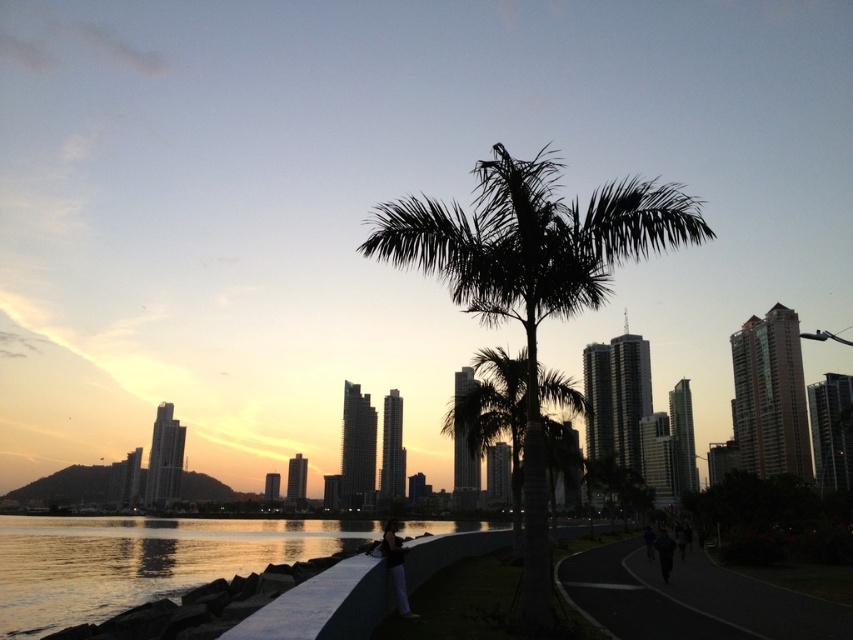
In the scene shown: Is smooth concrete wall at lower center positioned before black fabric pants at lower center?

No, smooth concrete wall at lower center is behind black fabric pants at lower center.

Image resolution: width=853 pixels, height=640 pixels. What are the coordinates of `smooth concrete wall at lower center` in the screenshot? It's located at (140, 561).

Identify the location of smooth concrete wall at lower center. Image resolution: width=853 pixels, height=640 pixels. (140, 561).

Who is higher up, black asphalt road at lower right or green leafy palm tree at center?

green leafy palm tree at center is above.

Can you confirm if black asphalt road at lower right is positioned to the left of green leafy palm tree at center?

In fact, black asphalt road at lower right is to the right of green leafy palm tree at center.

What do you see at coordinates (691, 600) in the screenshot? I see `black asphalt road at lower right` at bounding box center [691, 600].

Locate an element on the screen. The height and width of the screenshot is (640, 853). black asphalt road at lower right is located at coordinates (691, 600).

Is green leafy palm tree at center below dark fabric person at lower center?

Incorrect, green leafy palm tree at center is not positioned below dark fabric person at lower center.

Is point (518, 476) behind point (665, 561)?

Yes, it is behind point (665, 561).

Locate an element on the screen. This screenshot has height=640, width=853. green leafy palm tree at center is located at coordinates (492, 410).